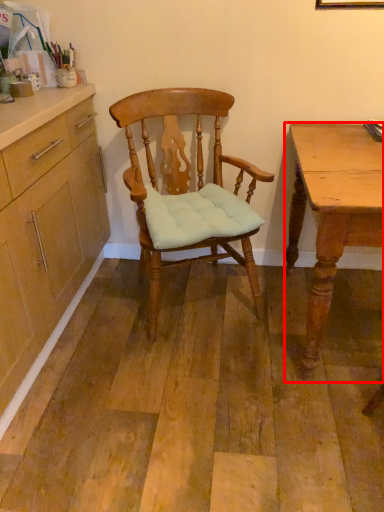
Question: Considering the relative positions of desk (annotated by the red box) and chair in the image provided, where is desk (annotated by the red box) located with respect to the staircase?

Choices:
 (A) right
 (B) left

Answer: (A)